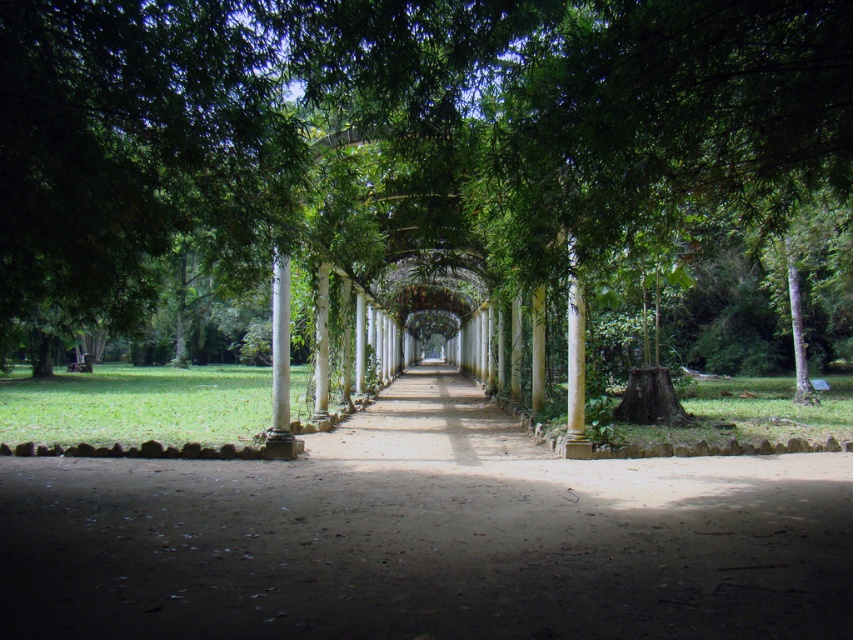
Does point (811, 307) lie behind point (352, 474)?

That is True.

You are a GUI agent. You are given a task and a screenshot of the screen. Output one action in this format:
    pyautogui.click(x=<x>, y=<y>)
    Task: Click on the green leafy tree at center
    The image size is (853, 640).
    Given the screenshot: What is the action you would take?
    pyautogui.click(x=433, y=170)